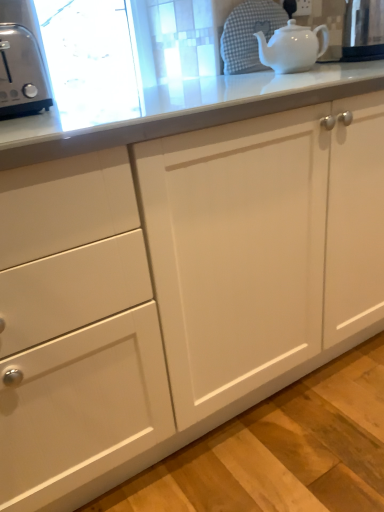
Image resolution: width=384 pixels, height=512 pixels. Describe the element at coordinates (21, 72) in the screenshot. I see `satin silver toaster at left` at that location.

Locate an element on the screen. The image size is (384, 512). white glossy teapot at upper right is located at coordinates (292, 47).

At what (x,y) coordinates should I click in order to perform the action: click on satin silver toaster at left. Please return your answer as a coordinate pair (x, y). The image size is (384, 512). Looking at the image, I should click on (21, 72).

From the image's perspective, is satin silver toaster at left on white glossy teapot at upper right?

No, from the image's perspective, satin silver toaster at left is not above white glossy teapot at upper right.

Considering the positions of objects satin silver toaster at left and white glossy teapot at upper right in the image provided, who is behind, satin silver toaster at left or white glossy teapot at upper right?

white glossy teapot at upper right is further from the camera.

Does satin silver toaster at left have a larger size compared to white glossy teapot at upper right?

Correct, satin silver toaster at left is larger in size than white glossy teapot at upper right.

Considering the sizes of objects satin silver toaster at left and white glossy teapot at upper right in the image provided, who is wider, satin silver toaster at left or white glossy teapot at upper right?

With larger width is satin silver toaster at left.

Consider the image. Does metallic stainless steel kettle at upper right come in front of satin silver toaster at left?

No, metallic stainless steel kettle at upper right is further to the viewer.

Does metallic stainless steel kettle at upper right have a larger size compared to satin silver toaster at left?

Actually, metallic stainless steel kettle at upper right might be smaller than satin silver toaster at left.

Which of these two, metallic stainless steel kettle at upper right or satin silver toaster at left, is wider?

Wider between the two is satin silver toaster at left.

Which is farther, (348,40) or (7,70)?

Positioned behind is point (348,40).

Considering the relative sizes of satin silver toaster at left and metallic stainless steel kettle at upper right in the image provided, is satin silver toaster at left taller than metallic stainless steel kettle at upper right?

No.

Can you confirm if satin silver toaster at left is positioned to the left of metallic stainless steel kettle at upper right?

Correct, you'll find satin silver toaster at left to the left of metallic stainless steel kettle at upper right.

Where is `toaster located in front of the metallic stainless steel kettle at upper right`? The width and height of the screenshot is (384, 512). toaster located in front of the metallic stainless steel kettle at upper right is located at coordinates click(x=21, y=72).

What's the angular difference between white glossy teapot at upper right and satin silver toaster at left's facing directions?

They differ by 0.00227 degrees in their facing directions.

Identify the location of toaster below the white glossy teapot at upper right (from the image's perspective). (21, 72).

Which object is positioned more to the left, white glossy teapot at upper right or satin silver toaster at left?

Positioned to the left is satin silver toaster at left.

Would you say satin silver toaster at left is part of white glossy teapot at upper right's contents?

Actually, satin silver toaster at left is outside white glossy teapot at upper right.

Which is behind, white glossy teapot at upper right or metallic stainless steel kettle at upper right?

Positioned behind is metallic stainless steel kettle at upper right.

Visually, is white glossy teapot at upper right positioned to the left or to the right of metallic stainless steel kettle at upper right?

white glossy teapot at upper right is positioned on metallic stainless steel kettle at upper right's left side.

Measure the distance between white glossy teapot at upper right and metallic stainless steel kettle at upper right.

white glossy teapot at upper right is 6.44 inches from metallic stainless steel kettle at upper right.

Choose the correct answer: Is white glossy teapot at upper right inside metallic stainless steel kettle at upper right or outside it?

white glossy teapot at upper right is not enclosed by metallic stainless steel kettle at upper right.

In the image, is metallic stainless steel kettle at upper right on the left side or the right side of white glossy teapot at upper right?

metallic stainless steel kettle at upper right is positioned on white glossy teapot at upper right's right side.

From a real-world perspective, is metallic stainless steel kettle at upper right located higher than white glossy teapot at upper right?

Yes, from a real-world perspective, metallic stainless steel kettle at upper right is over white glossy teapot at upper right

Do you think metallic stainless steel kettle at upper right is within white glossy teapot at upper right, or outside of it?

metallic stainless steel kettle at upper right exists outside the volume of white glossy teapot at upper right.

This screenshot has height=512, width=384. Find the location of `toaster on the left of white glossy teapot at upper right`. toaster on the left of white glossy teapot at upper right is located at coordinates (21, 72).

You are a GUI agent. You are given a task and a screenshot of the screen. Output one action in this format:
    pyautogui.click(x=<x>, y=<y>)
    Task: Click on the toaster below the metallic stainless steel kettle at upper right (from a real-world perspective)
    The image size is (384, 512).
    Given the screenshot: What is the action you would take?
    pyautogui.click(x=21, y=72)

Consider the image. Considering their positions, is metallic stainless steel kettle at upper right positioned further to white glossy teapot at upper right than satin silver toaster at left?

Among the two, satin silver toaster at left is located further to white glossy teapot at upper right.

From the image, which object appears to be farther from satin silver toaster at left, metallic stainless steel kettle at upper right or white glossy teapot at upper right?

Result: The object further to satin silver toaster at left is metallic stainless steel kettle at upper right.

Based on their spatial positions, is satin silver toaster at left or white glossy teapot at upper right closer to metallic stainless steel kettle at upper right?

The object closer to metallic stainless steel kettle at upper right is white glossy teapot at upper right.

From the picture: Looking at the image, which one is located further to metallic stainless steel kettle at upper right, white glossy teapot at upper right or satin silver toaster at left?

satin silver toaster at left is positioned further to the anchor metallic stainless steel kettle at upper right.

From the image, which object appears to be nearer to white glossy teapot at upper right, satin silver toaster at left or metallic stainless steel kettle at upper right?

Based on the image, metallic stainless steel kettle at upper right appears to be nearer to white glossy teapot at upper right.

Looking at the image, which one is located further to satin silver toaster at left, white glossy teapot at upper right or metallic stainless steel kettle at upper right?

metallic stainless steel kettle at upper right is further to satin silver toaster at left.

At what (x,y) coordinates should I click in order to perform the action: click on teapot between satin silver toaster at left and metallic stainless steel kettle at upper right. Please return your answer as a coordinate pair (x, y). Looking at the image, I should click on (292, 47).